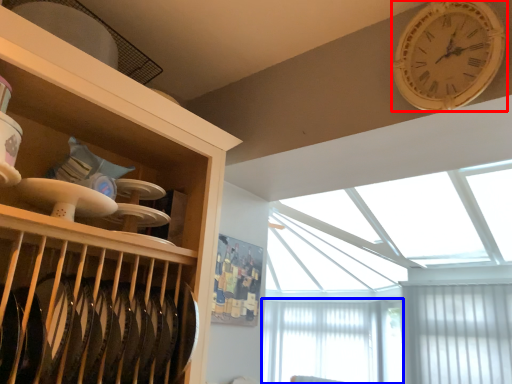
Question: Which of the following is the closest to the observer, wall clock (highlighted by a red box) or window screen (highlighted by a blue box)?

Choices:
 (A) wall clock
 (B) window screen

Answer: (A)